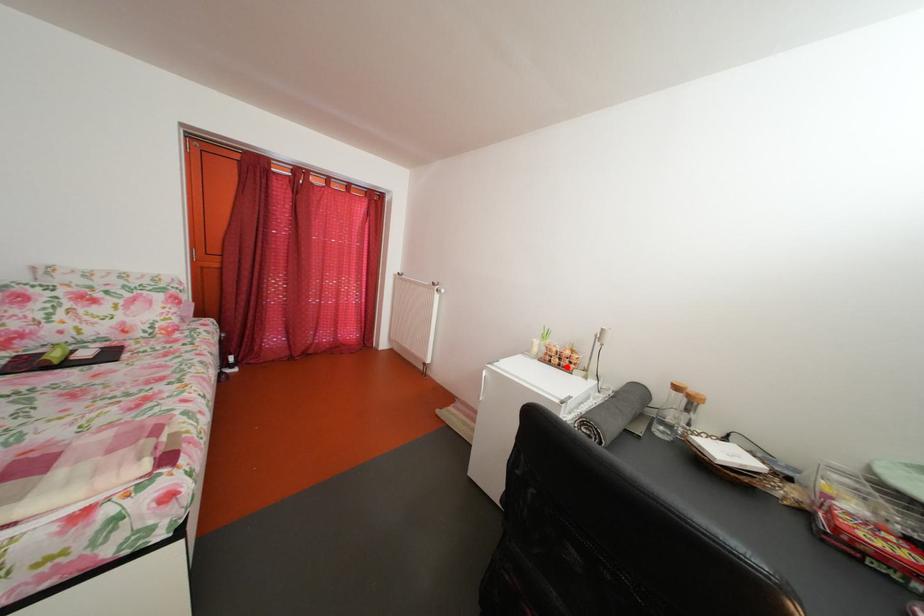
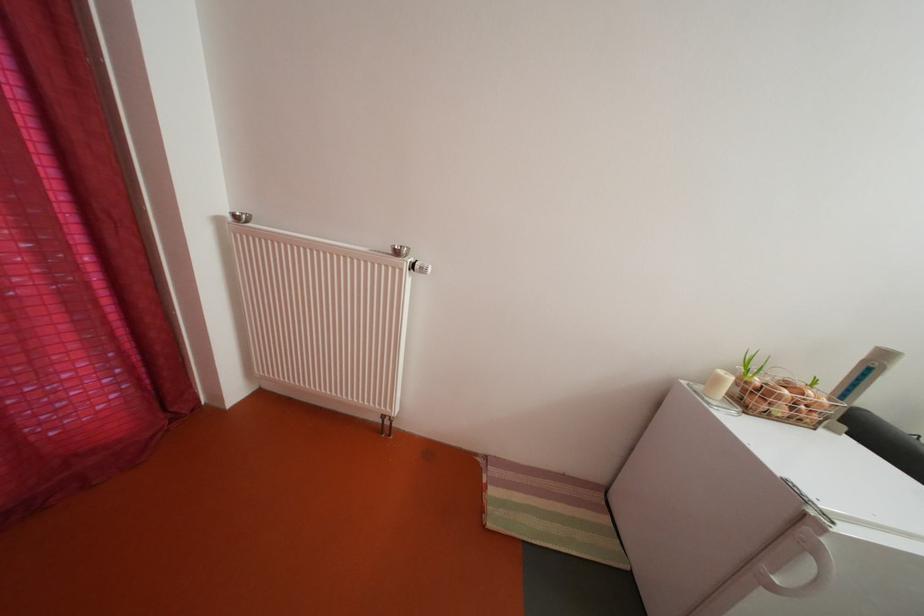
Question: I am providing you with two images of the same scene from different viewpoints. A red point is marked on the first image. Can you still see the location of the red point in image 2?

Choices:
 (A) Yes
 (B) No

Answer: (A)